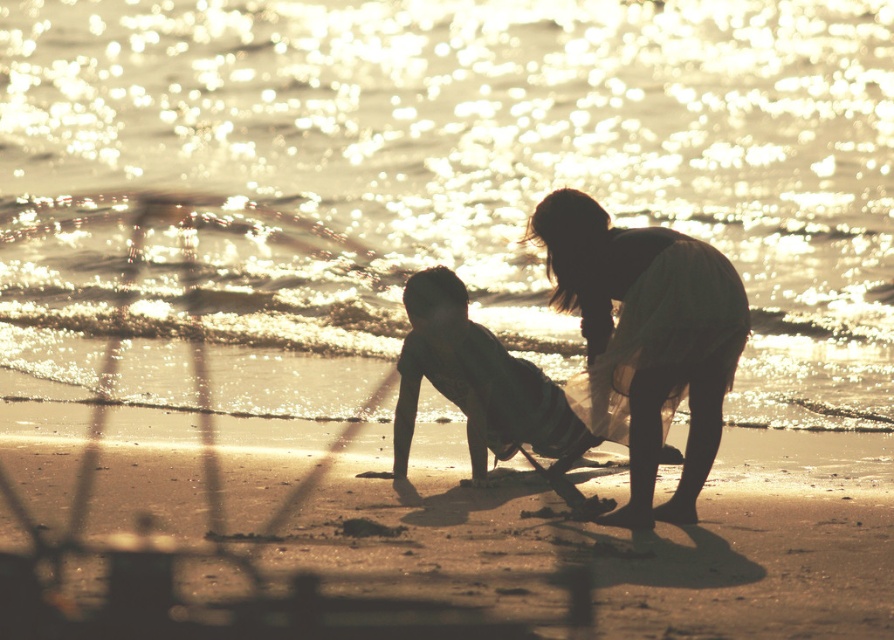
You are a photographer trying to capture the silhouette skin child at center and the sparkling golden water at center in the same frame. Based on the scene, which object occupies more horizontal space in the image?

The sparkling golden water at center is wider than the silhouette skin child at center, so it occupies more horizontal space in the image.

You are standing at the edge of the beach and see the sparkling golden water at center and the smooth sand at lower center. Which one is closer to your right side?

The smooth sand at lower center is closer to your right side because the sparkling golden water at center is to the left of it.

You are a photographer trying to capture a photo of the silhouette dress at center and the silhouette skin child at center. Since you want to ensure both subjects are in focus, you need to know which one is taller. Can you tell me which is taller?

The silhouette dress at center is taller than the silhouette skin child at center according to the description.